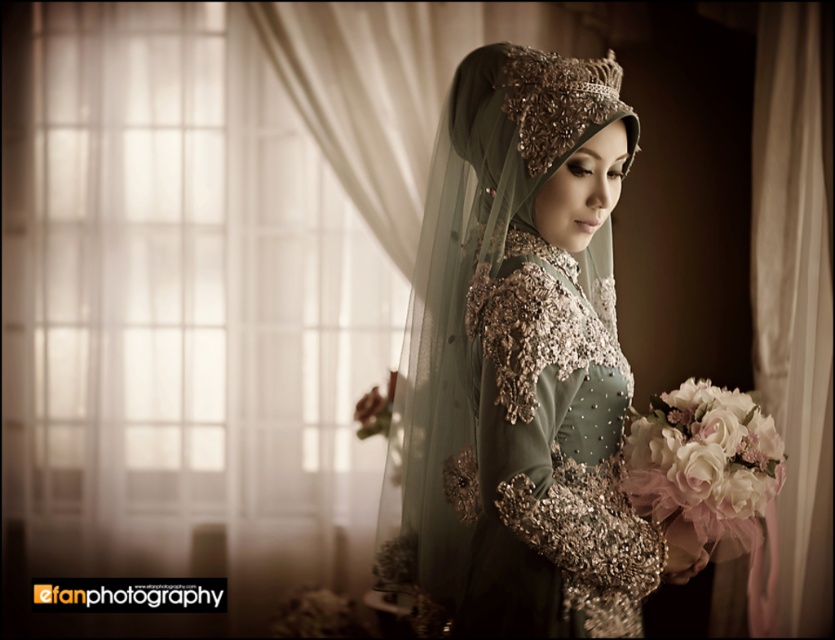
You are a photographer setting up for a wedding shoot. You need to ensure that the satin shimmering dress at center is fully visible in the frame without any obstruction. Given that the white sheer curtain at right is larger, how should you position the camera to achieve this?

Since the satin shimmering dress at center occupies less space than the white sheer curtain at right, position the camera closer to the dress to ensure it fills the frame adequately while keeping the curtain at the edge to avoid blocking the dress.

You are a photographer setting up for a wedding shoot. The bride is wearing two dresses, the satin green dress at center and the satin shimmering dress at center. You need to ensure that the taller dress is positioned closer to the window to catch the light better. Which dress should you place near the window?

The satin green dress at center is much taller than the satin shimmering dress at center, so you should place the satin green dress at center near the window to ensure it catches the light appropriately.